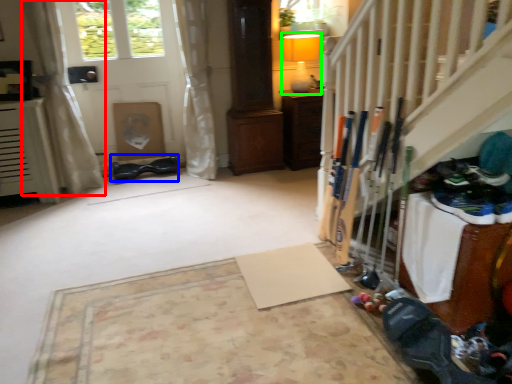
Question: Based on their relative distances, which object is nearer to curtain (highlighted by a red box)? Choose from shoe (highlighted by a blue box) and lamp (highlighted by a green box).

Choices:
 (A) shoe
 (B) lamp

Answer: (A)